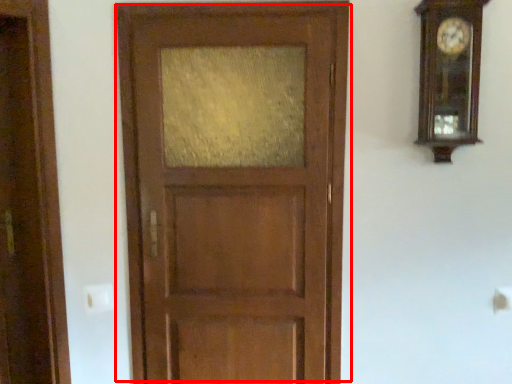
Question: Considering the relative positions of door (annotated by the red box) and clock in the image provided, where is door (annotated by the red box) located with respect to the staircase?

Choices:
 (A) right
 (B) left

Answer: (B)